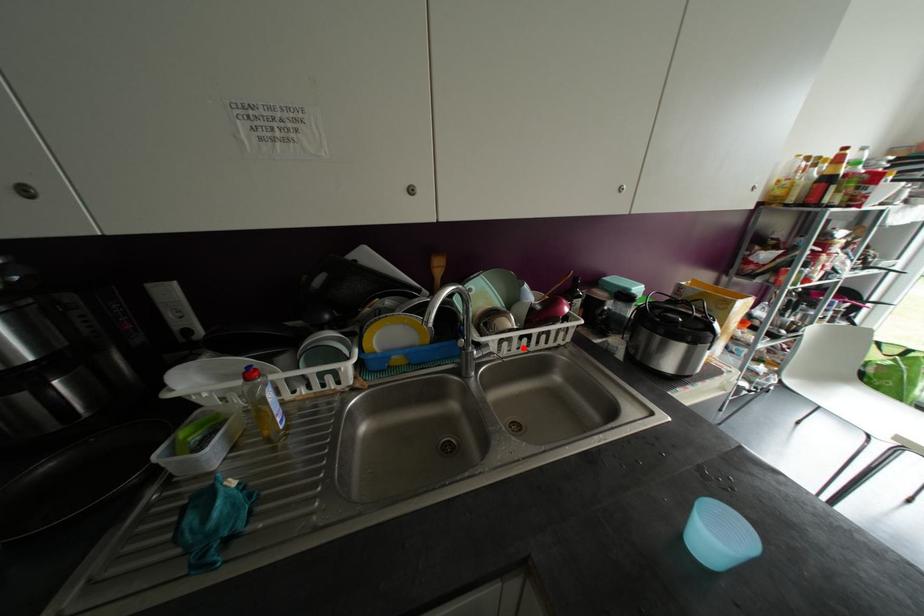
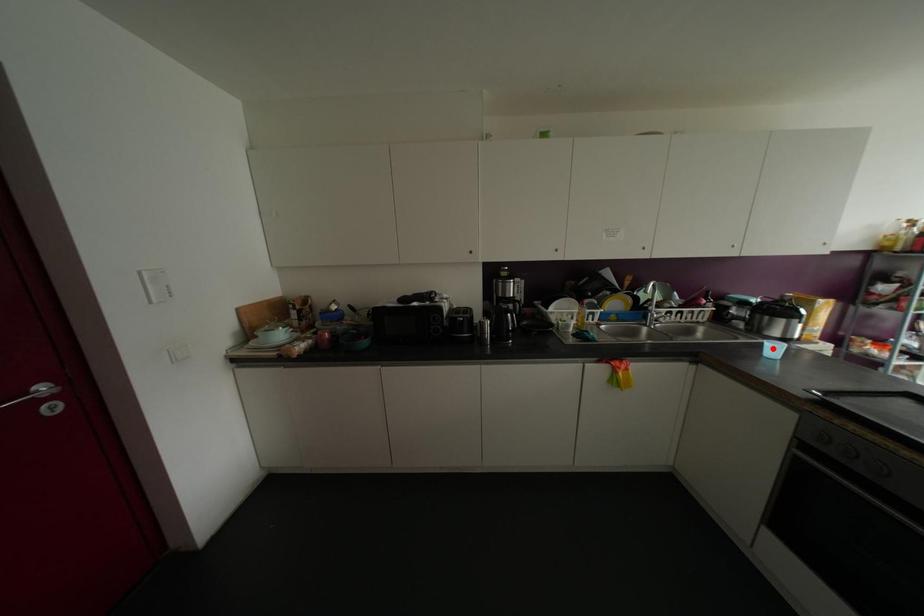
I am providing you with two images of the same scene from different viewpoints. A red point is marked on the first image and another point is marked on the second image. Do the highlighted points in image1 and image2 indicate the same real-world spot?

No